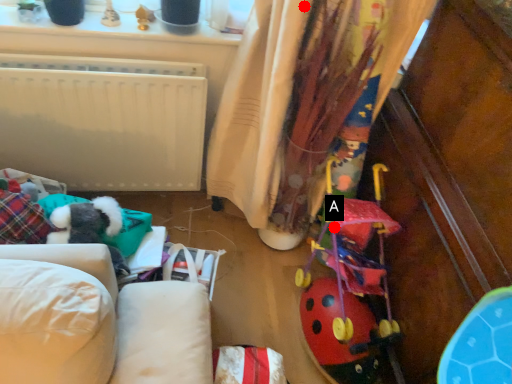
Question: Two points are circled on the image, labeled by A and B beside each circle. Which point is closer to the camera?

Choices:
 (A) A is closer
 (B) B is closer

Answer: (B)